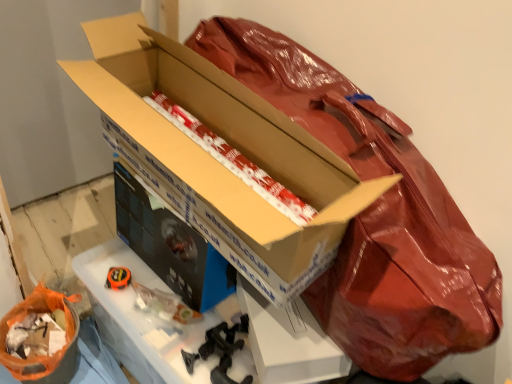
Question: Should I look upward or downward to see orange plastic bag at lower left, arranged as the second wrapping paper when viewed from the top?

Choices:
 (A) up
 (B) down

Answer: (B)

Question: Is white/red striped paper at center, the second wrapping paper ordered from the bottom, positioned beyond the bounds of matte cardboard box at center, arranged as the 2th box when viewed from the front?

Choices:
 (A) yes
 (B) no

Answer: (A)

Question: Considering the relative positions of white/red striped paper at center, the 1th wrapping paper positioned from the right, and matte cardboard box at center, the first box positioned from the back, in the image provided, is white/red striped paper at center, the 1th wrapping paper positioned from the right, behind matte cardboard box at center, the first box positioned from the back,?

Choices:
 (A) no
 (B) yes

Answer: (A)

Question: Could you tell me if white/red striped paper at center, the 1th wrapping paper positioned from the right, is facing matte cardboard box at center, the first box positioned from the back?

Choices:
 (A) yes
 (B) no

Answer: (B)

Question: Considering the relative sizes of white/red striped paper at center, the second wrapping paper ordered from the bottom, and matte cardboard box at center, the first box positioned from the back, in the image provided, is white/red striped paper at center, the second wrapping paper ordered from the bottom, smaller than matte cardboard box at center, the first box positioned from the back,?

Choices:
 (A) no
 (B) yes

Answer: (B)

Question: Is the position of white/red striped paper at center, the 1th wrapping paper positioned from the right, less distant than that of matte cardboard box at center, arranged as the 2th box when viewed from the front?

Choices:
 (A) yes
 (B) no

Answer: (A)

Question: Does white/red striped paper at center, the 1th wrapping paper in the top-to-bottom sequence, have a lesser width compared to matte cardboard box at center, arranged as the 2th box when viewed from the front?

Choices:
 (A) yes
 (B) no

Answer: (B)

Question: Is white/red striped paper at center, the second wrapping paper ordered from the bottom, thinner than cardboard box at center, which is counted as the 2th box, starting from the back?

Choices:
 (A) yes
 (B) no

Answer: (B)

Question: Is white/red striped paper at center, the 1th wrapping paper in the top-to-bottom sequence, touching cardboard box at center, the 1th box when ordered from front to back?

Choices:
 (A) yes
 (B) no

Answer: (A)

Question: Is white/red striped paper at center, the 1th wrapping paper positioned from the right, bigger than cardboard box at center, which is counted as the 2th box, starting from the back?

Choices:
 (A) no
 (B) yes

Answer: (A)

Question: Would you say white/red striped paper at center, the 2th wrapping paper when ordered from left to right, contains cardboard box at center, the 1th box when ordered from front to back?

Choices:
 (A) yes
 (B) no

Answer: (B)

Question: Considering the relative positions of white/red striped paper at center, the second wrapping paper ordered from the bottom, and cardboard box at center, which is counted as the 2th box, starting from the back, in the image provided, is white/red striped paper at center, the second wrapping paper ordered from the bottom, to the left of cardboard box at center, which is counted as the 2th box, starting from the back, from the viewer's perspective?

Choices:
 (A) no
 (B) yes

Answer: (A)

Question: From the image's perspective, is white/red striped paper at center, the 2th wrapping paper when ordered from left to right, under cardboard box at center, which is counted as the 2th box, starting from the back?

Choices:
 (A) no
 (B) yes

Answer: (A)

Question: Is black cardboard workbench at center positioned before white/red striped paper at center, the 2th wrapping paper when ordered from left to right?

Choices:
 (A) yes
 (B) no

Answer: (B)